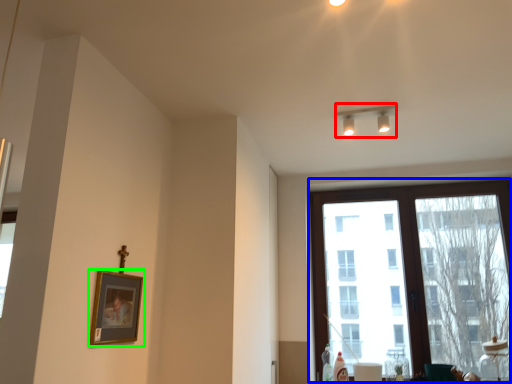
Question: Which object is the farthest from lamp (highlighted by a red box)? Choose among these: window (highlighted by a blue box) or picture frame (highlighted by a green box).

Choices:
 (A) window
 (B) picture frame

Answer: (B)